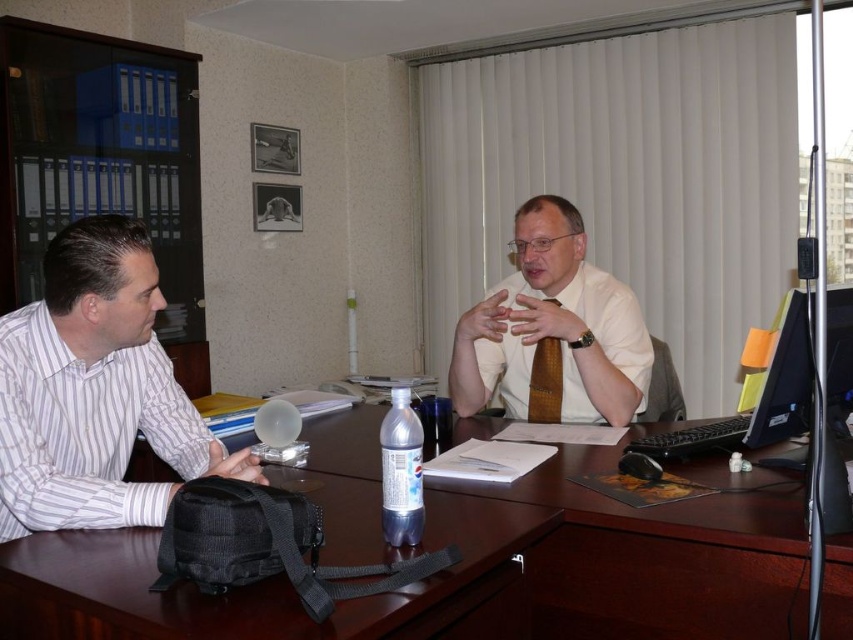
Question: Which of the following is the farthest from the observer?

Choices:
 (A) (488, 540)
 (B) (256, 464)
 (C) (569, 420)

Answer: (C)

Question: Which object is the farthest from the white glossy shirt at center?

Choices:
 (A) black fabric bag at center
 (B) black matte bag at left
 (C) brown woven tie at right
 (D) striped cotton shirt at left

Answer: (D)

Question: Which point is farther from the camera taking this photo?

Choices:
 (A) (543, 374)
 (B) (126, 328)

Answer: (A)

Question: Can you confirm if black matte bag at left is positioned below black fabric bag at center?

Choices:
 (A) yes
 (B) no

Answer: (B)

Question: Is striped cotton shirt at left above brown woven tie at right?

Choices:
 (A) yes
 (B) no

Answer: (A)

Question: Is black matte bag at left below black fabric bag at center?

Choices:
 (A) no
 (B) yes

Answer: (A)